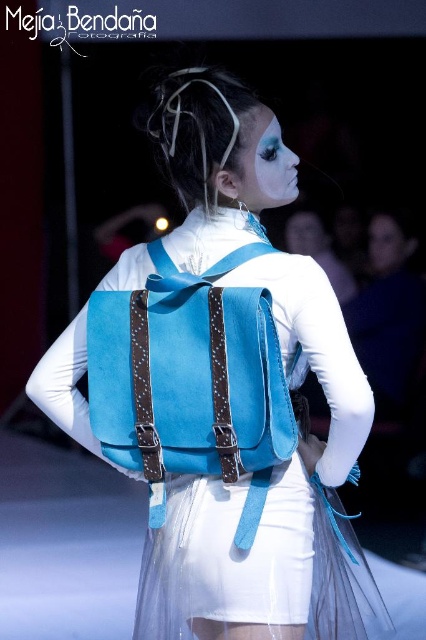
You are a photographer standing in front of the runway. You notice two points marked on the runway. The first point is at coordinate point [161,275] and the second point is at coordinate point [256,172]. Which point is closer to you?

Point [161,275] is further to the camera than point [256,172], so the point closer to you is point [256,172].